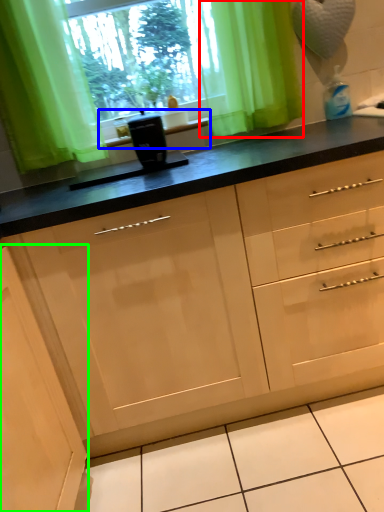
Question: Based on their relative distances, which object is nearer to curtain (highlighted by a red box)? Choose from window sill (highlighted by a blue box) and cabinetry (highlighted by a green box).

Choices:
 (A) window sill
 (B) cabinetry

Answer: (A)